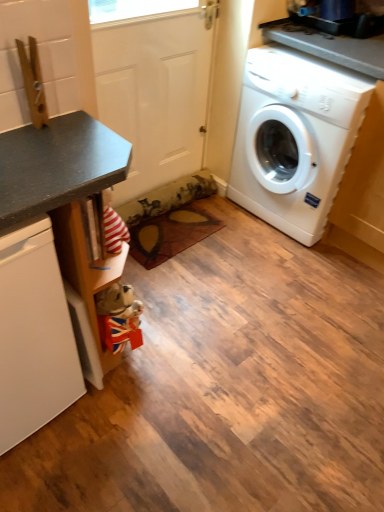
Locate an element on the screen. free space between white plastic washing machine at right and matte black counter at left is located at coordinates (210, 273).